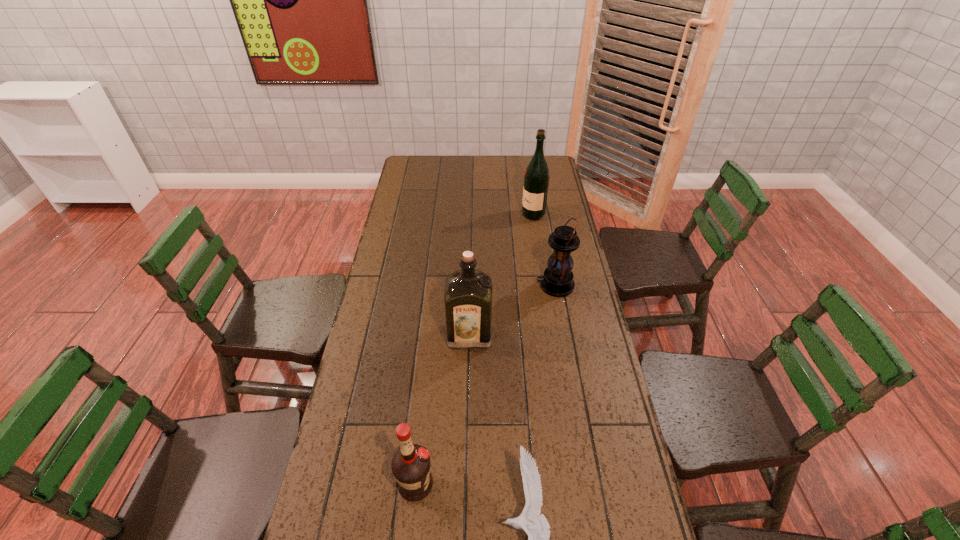
I want to click on vacant space located on the label of the fourth object from right to left, so click(x=468, y=368).

Identify some points in free space located above the lantern, indicating its light source. Please provide its 2D coordinates. Your answer should be formatted as a tuple, i.e. [(x, y)], where the tuple contains the x and y coordinates of a point satisfying the conditions above.

[(507, 285)]

Locate several spots in free space located above the lantern, indicating its light source. Please provide its 2D coordinates. Your answer should be formatted as a tuple, i.e. [(x, y)], where the tuple contains the x and y coordinates of a point satisfying the conditions above.

[(491, 285)]

Find a few locations in the blank space located 0.050m above the lantern, indicating its light source. Please provide its 2D coordinates. Your answer should be formatted as a tuple, i.e. [(x, y)], where the tuple contains the x and y coordinates of a point satisfying the conditions above.

[(523, 285)]

Locate an element on the screen. The width and height of the screenshot is (960, 540). vacant region located on the front and back of the leftmost liquor is located at coordinates (531, 485).

I want to click on liquor that is at the right edge, so click(536, 178).

Where is `lantern present at the right edge`? lantern present at the right edge is located at coordinates (557, 280).

At what (x,y) coordinates should I click in order to perform the action: click on free spot at the far edge of the desktop. Please return your answer as a coordinate pair (x, y). Looking at the image, I should click on (468, 167).

Locate an element on the screen. vacant space at the left edge is located at coordinates (382, 251).

Find the location of a particular element. This screenshot has width=960, height=540. free spot at the right edge of the desktop is located at coordinates (572, 396).